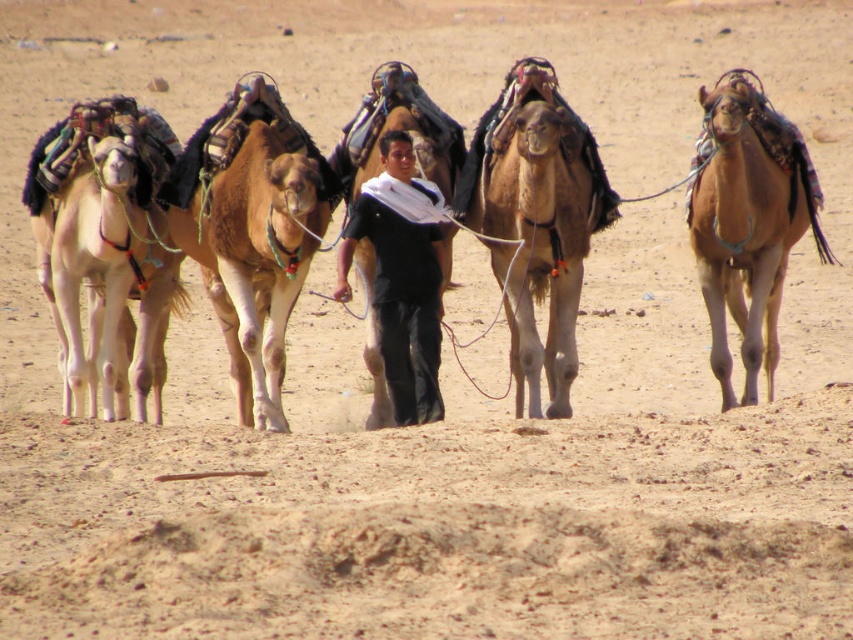
Question: Is brown fuzzy camel at center to the right of brown matte camel at right from the viewer's perspective?

Choices:
 (A) no
 (B) yes

Answer: (A)

Question: Does brown fuzzy camel at center come behind brown matte camel at right?

Choices:
 (A) yes
 (B) no

Answer: (B)

Question: Which object appears closest to the camera in this image?

Choices:
 (A) brown textured camel at center
 (B) black cotton shirt at center
 (C) brown fuzzy camel at center
 (D) light beige fabric camel at left

Answer: (C)

Question: Estimate the real-world distances between objects in this image. Which object is farther from the black cotton shirt at center?

Choices:
 (A) brown matte camel at right
 (B) brown fuzzy camel at center
 (C) brown textured camel at center
 (D) light beige fabric camel at left

Answer: (A)

Question: Does brown textured camel at center appear under brown fuzzy camel at center?

Choices:
 (A) no
 (B) yes

Answer: (A)

Question: Which point is farther to the camera?

Choices:
 (A) brown fuzzy camel at center
 (B) brown textured camel at center
 (C) black cotton shirt at center
 (D) light beige fabric camel at left

Answer: (D)